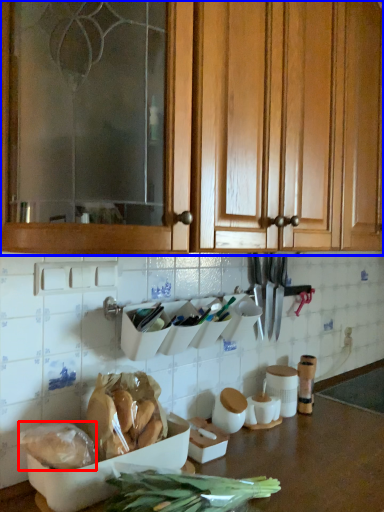
Question: Among these objects, which one is farthest to the camera, food (highlighted by a red box) or cabinetry (highlighted by a blue box)?

Choices:
 (A) food
 (B) cabinetry

Answer: (A)